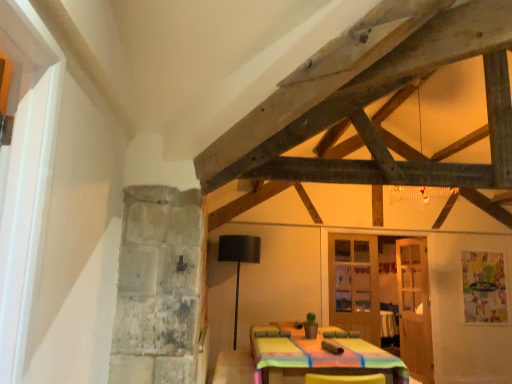
Question: Is matte glass door at center, which is the 2th door from back to front, to the left or to the right of wooden glass door at center, the third door in the back-to-front sequence, in the image?

Choices:
 (A) right
 (B) left

Answer: (B)

Question: From a real-world perspective, is matte glass door at center, which is the 2th door from back to front, positioned above or below wooden glass door at center, acting as the 1th door starting from the front?

Choices:
 (A) below
 (B) above

Answer: (B)

Question: Considering the real-world distances, which object is closest to the black matte lamp at center?

Choices:
 (A) matte glass door at center, which is the 2th door from back to front
 (B) wooden glass door at center, the third door in the back-to-front sequence
 (C) wooden door at right, which is the 3th door from front to back

Answer: (A)

Question: Estimate the real-world distances between objects in this image. Which object is closer to the black matte lamp at center?

Choices:
 (A) matte glass door at center, which is the 2th door from back to front
 (B) wooden glass door at center, the third door in the back-to-front sequence
 (C) wooden door at right, acting as the first door starting from the back

Answer: (A)